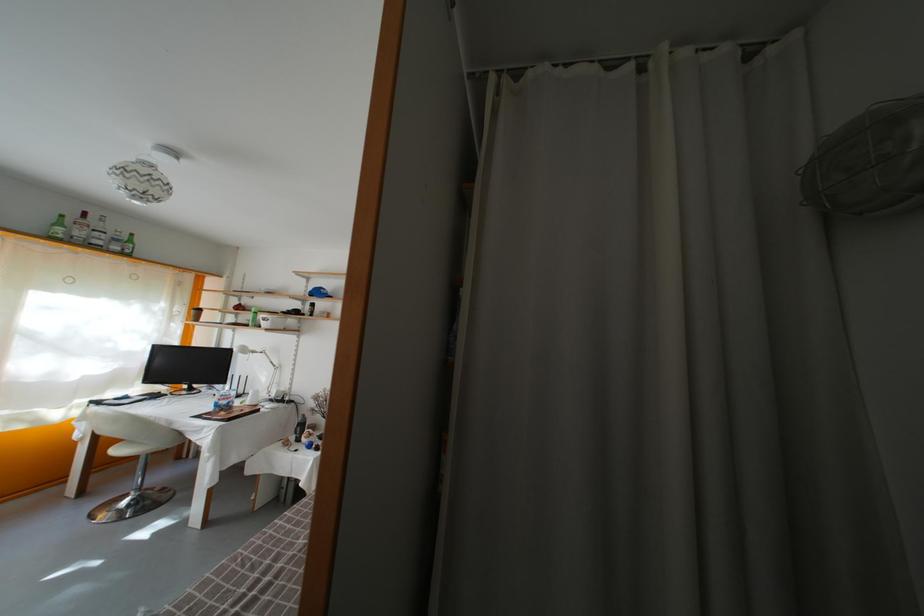
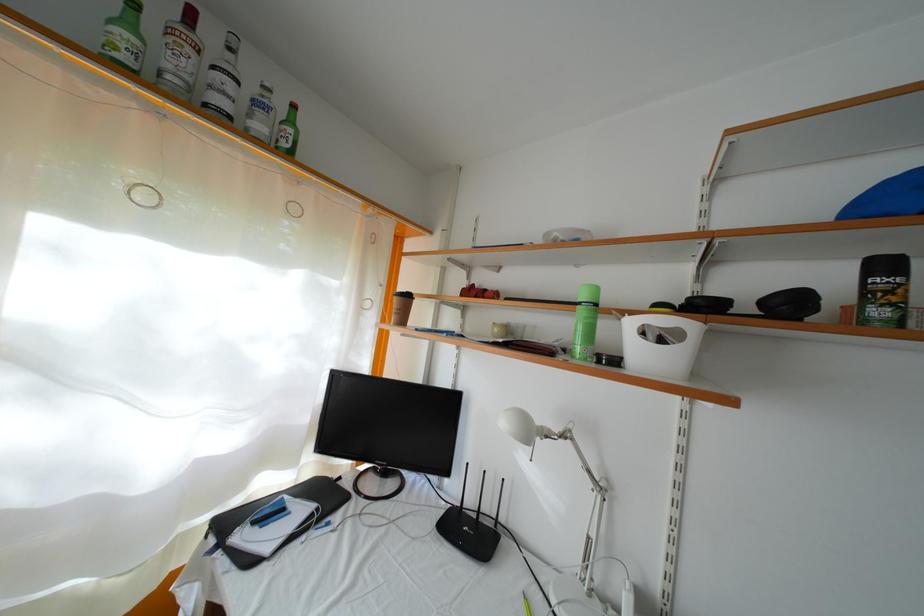
Find the pixel in the second image that matches point (137, 248) in the first image.

(297, 128)